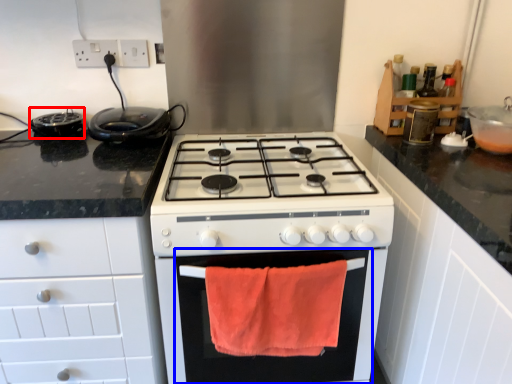
Question: Which point is closer to the camera, appliance (highlighted by a red box) or oven (highlighted by a blue box)?

Choices:
 (A) appliance
 (B) oven

Answer: (B)